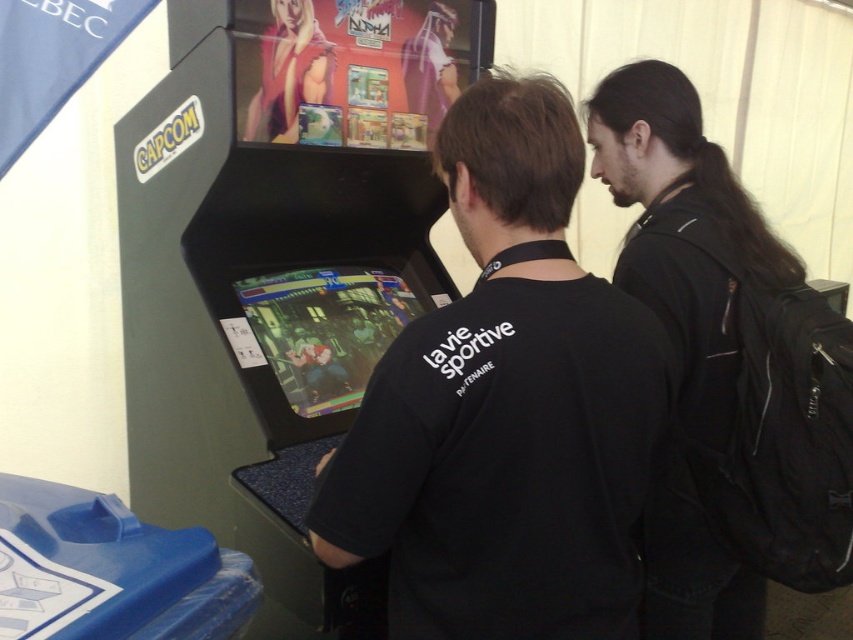
You are a photographer trying to capture a candid shot of both the black matte shirt at center and the black leather jacket at upper right. Since you want to ensure both subjects are fully visible in the frame, which subject should you focus on first to account for their height differences?

The black matte shirt at center is shorter than the black leather jacket at upper right. Therefore, you should focus on the black leather jacket at upper right first, as it is taller and requires adjusting the camera angle to include its full height before framing the shorter subject.

You are trying to decide which clothing item to purchase between the black matte shirt at center and the black leather jacket at upper right. Based on their sizes, which one is more suitable for a gift for a friend who prefers compact and easy to carry items?

The black matte shirt at center is smaller than the black leather jacket at upper right, making it more suitable for a gift that needs to be compact and easy to carry.